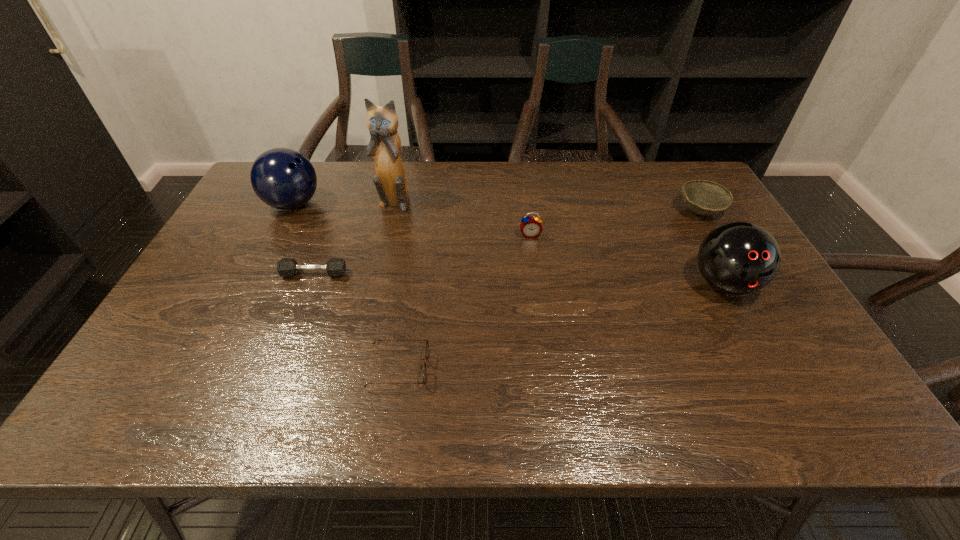
Identify the location of unoccupied area between the third shortest object and the left bowling ball. The image size is (960, 540). (496, 207).

The image size is (960, 540). Find the location of `empty space that is in between the shortest object and the bowl`. empty space that is in between the shortest object and the bowl is located at coordinates (549, 289).

Locate an element on the screen. The image size is (960, 540). free space between the right bowling ball and the nearest object is located at coordinates (562, 326).

Where is `unoccupied area between the cat and the second shortest object`? unoccupied area between the cat and the second shortest object is located at coordinates (354, 238).

The width and height of the screenshot is (960, 540). Find the location of `empty space that is in between the third object from right to left and the right bowling ball`. empty space that is in between the third object from right to left and the right bowling ball is located at coordinates (627, 259).

You are a GUI agent. You are given a task and a screenshot of the screen. Output one action in this format:
    pyautogui.click(x=<x>, y=<y>)
    Task: Click on the unoccupied area between the bowl and the left bowling ball
    This screenshot has height=540, width=960.
    Given the screenshot: What is the action you would take?
    pyautogui.click(x=496, y=207)

Identify the location of vacant region between the sixth tallest object and the shortest object. (356, 321).

Identify the location of unoccupied area between the dumbbell and the third shortest object. [x=507, y=242].

You are a GUI agent. You are given a task and a screenshot of the screen. Output one action in this format:
    pyautogui.click(x=<x>, y=<y>)
    Task: Click on the empty space that is in between the fourth tallest object and the tallest object
    
    Given the screenshot: What is the action you would take?
    pyautogui.click(x=462, y=218)

Where is `free space that is in between the cat and the farther bowling ball`? free space that is in between the cat and the farther bowling ball is located at coordinates (344, 203).